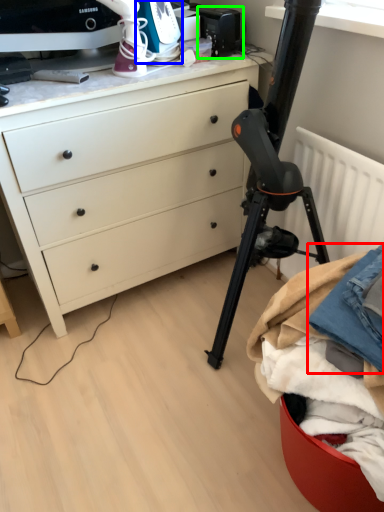
Question: Which is nearer to the clothing (highlighted by a red box)? appliance (highlighted by a blue box) or appliance (highlighted by a green box).

Choices:
 (A) appliance
 (B) appliance

Answer: (A)